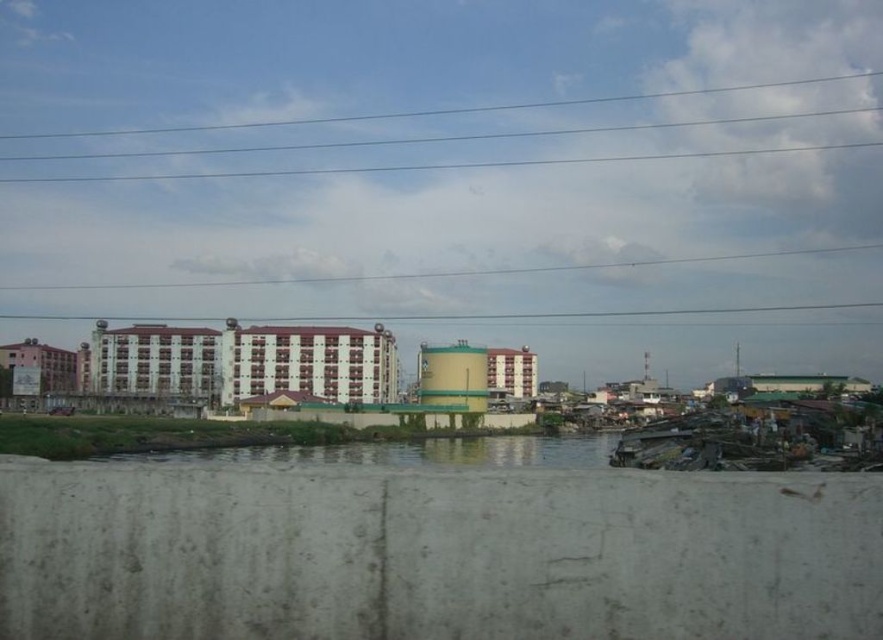
Question: Can you confirm if white concrete building at center is bigger than clear water at center?

Choices:
 (A) no
 (B) yes

Answer: (A)

Question: Which object is farther from the camera taking this photo?

Choices:
 (A) clear water at center
 (B) clear blue wires at upper center
 (C) white concrete building at center

Answer: (B)

Question: Which object is the closest to the clear water at center?

Choices:
 (A) white concrete building at center
 (B) clear blue wires at upper center

Answer: (A)

Question: Which of the following is the farthest from the observer?

Choices:
 (A) (329, 362)
 (B) (503, 458)

Answer: (A)

Question: Does clear water at center lie in front of clear blue wires at upper center?

Choices:
 (A) no
 (B) yes

Answer: (B)

Question: Does white concrete building at center have a larger size compared to clear blue wires at upper center?

Choices:
 (A) yes
 (B) no

Answer: (B)